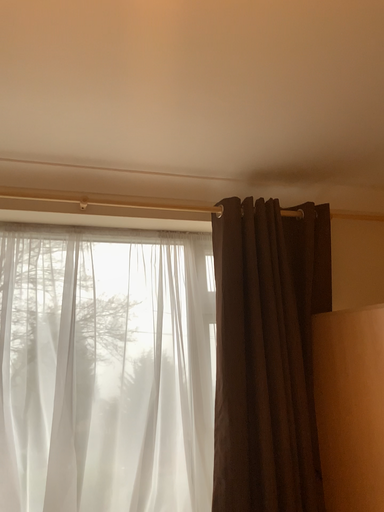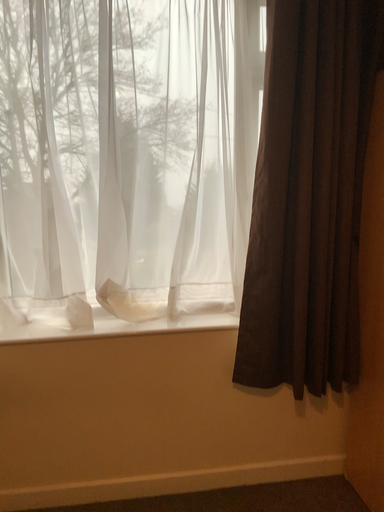
Question: Which way did the camera rotate in the video?

Choices:
 (A) rotated downward
 (B) rotated upward

Answer: (A)